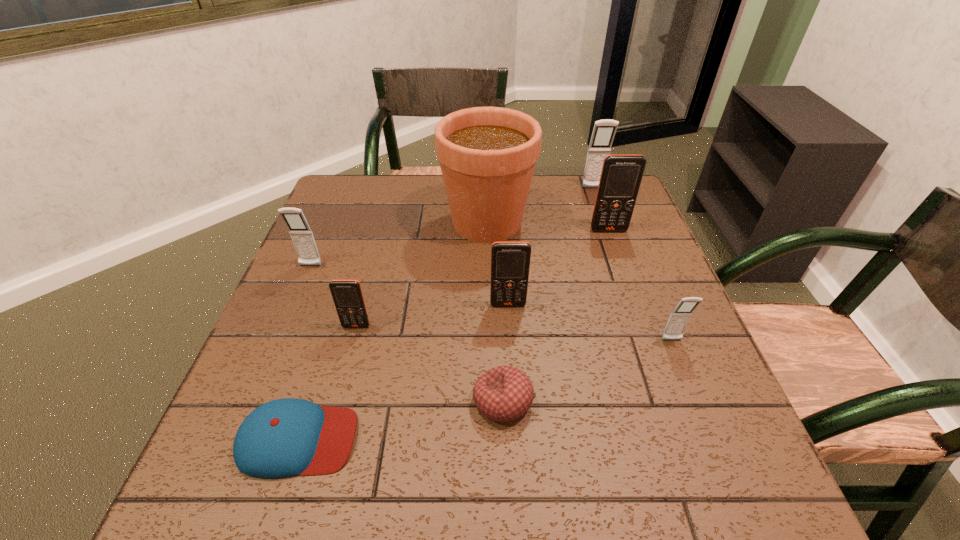
This screenshot has width=960, height=540. What are the coordinates of `flowerpot` in the screenshot? It's located at (487, 155).

You are a GUI agent. You are given a task and a screenshot of the screen. Output one action in this format:
    pyautogui.click(x=<x>, y=<y>)
    Task: Click on the farthest object
    Image resolution: width=960 pixels, height=540 pixels.
    Given the screenshot: What is the action you would take?
    pyautogui.click(x=604, y=131)

Where is `the second gray cellular telephone from right to left`? The width and height of the screenshot is (960, 540). the second gray cellular telephone from right to left is located at coordinates (604, 131).

The height and width of the screenshot is (540, 960). What are the coordinates of `the biggest orange cellular telephone` in the screenshot? It's located at (621, 175).

Where is `the farthest orange cellular telephone`? Image resolution: width=960 pixels, height=540 pixels. the farthest orange cellular telephone is located at coordinates (621, 175).

What are the coordinates of `the second smallest gray cellular telephone` in the screenshot? It's located at (301, 234).

You are a GUI agent. You are given a task and a screenshot of the screen. Output one action in this format:
    pyautogui.click(x=<x>, y=<y>)
    Task: Click on the third farthest cellular telephone
    This screenshot has height=540, width=960.
    Given the screenshot: What is the action you would take?
    pyautogui.click(x=301, y=234)

Where is `the third nearest cellular telephone`? Image resolution: width=960 pixels, height=540 pixels. the third nearest cellular telephone is located at coordinates (510, 261).

Where is `the fourth cellular telephone from right to left`? The width and height of the screenshot is (960, 540). the fourth cellular telephone from right to left is located at coordinates (510, 261).

Identify the location of the second nearest cellular telephone. The width and height of the screenshot is (960, 540). (347, 295).